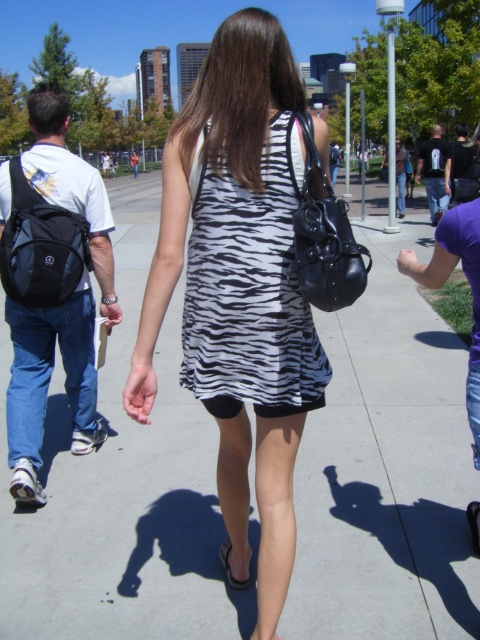
You are standing in the plaza and want to walk to the black fabric backpack at left. Which direction should you move relative to the matte concrete sidewalk at center?

To reach the black fabric backpack at left, you should move away from the matte concrete sidewalk at center since the sidewalk is closer to you than the backpack.

You are a photographer trying to capture the woman in the zebra dress. You notice the matte black handbag at center and the black synthetic sandal at lower center in your frame. Which object is positioned higher in the image?

The matte black handbag at center is taller than the black synthetic sandal at lower center, so it is positioned higher in the image.

You are standing on the matte concrete sidewalk at center and want to place the black leather sandal at lower center on top of it. Will the sandal fit entirely on the sidewalk?

The matte concrete sidewalk at center has a greater height compared to the black leather sandal at lower center, so the sandal will fit entirely on the sidewalk since the sidewalk is higher than the sandal.